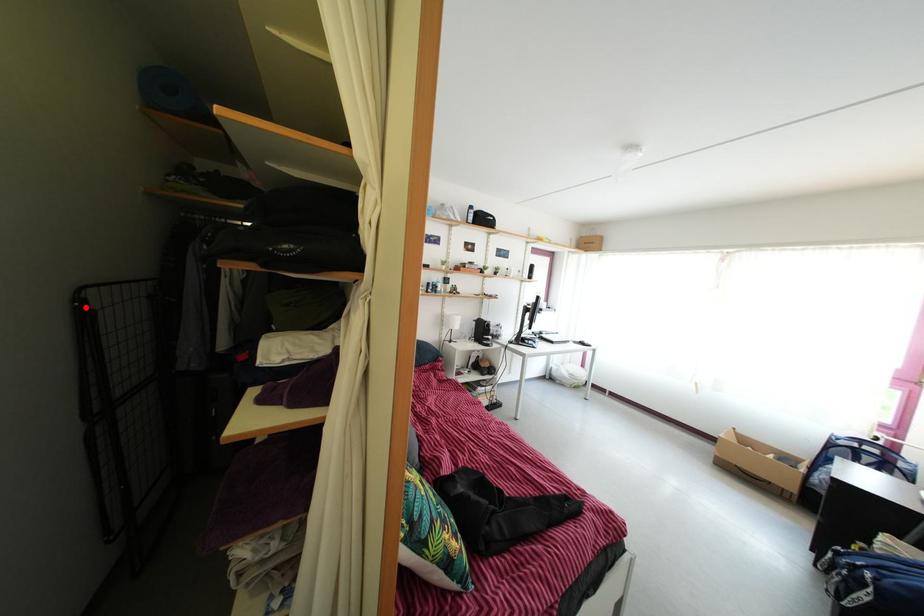
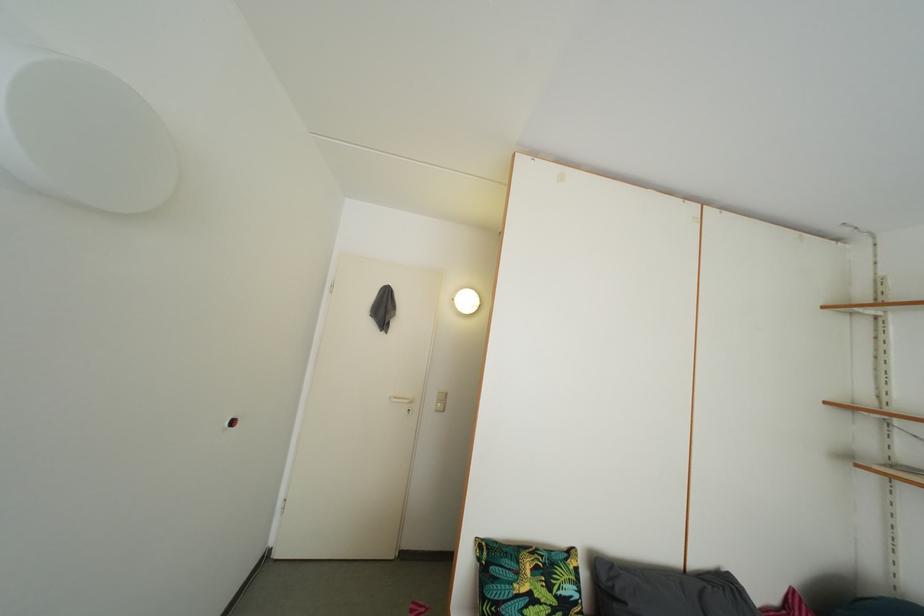
Question: I am providing you with two images of the same scene from different viewpoints. A red point is marked on the first image. Can you still see the location of the red point in image 2?

Choices:
 (A) Yes
 (B) No

Answer: (B)